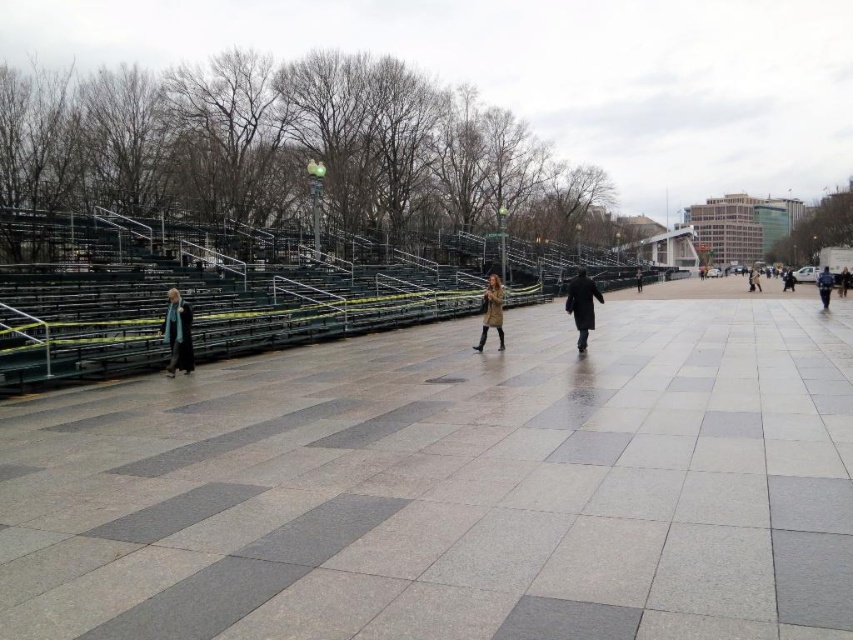
Consider the image. You are a pedestrian walking from the left side of the image towards the right. You see a dark blue coat at right and a dark brown leather jacket at center. Which item will you encounter first as you walk towards the right?

The dark brown leather jacket at center will be encountered first because the dark blue coat at right is positioned under it, meaning the jacket is above the coat in the vertical plane.

Based on the photo, you are standing at the point with coordinates (x=824, y=285) in the image. What object is located at that point?

The point at coordinates 0.468, 0.967 corresponds to the dark blue coat at right.